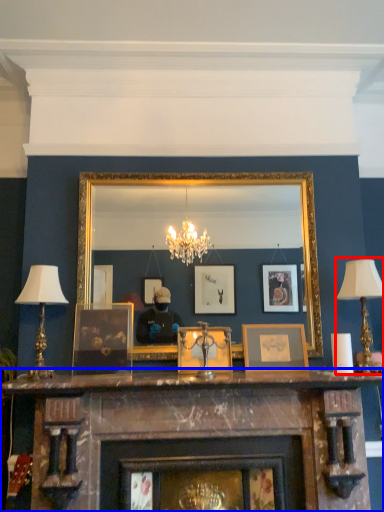
Question: Which object appears closest to the camera in this image, table lamp (highlighted by a red box) or fireplace (highlighted by a blue box)?

Choices:
 (A) table lamp
 (B) fireplace

Answer: (B)